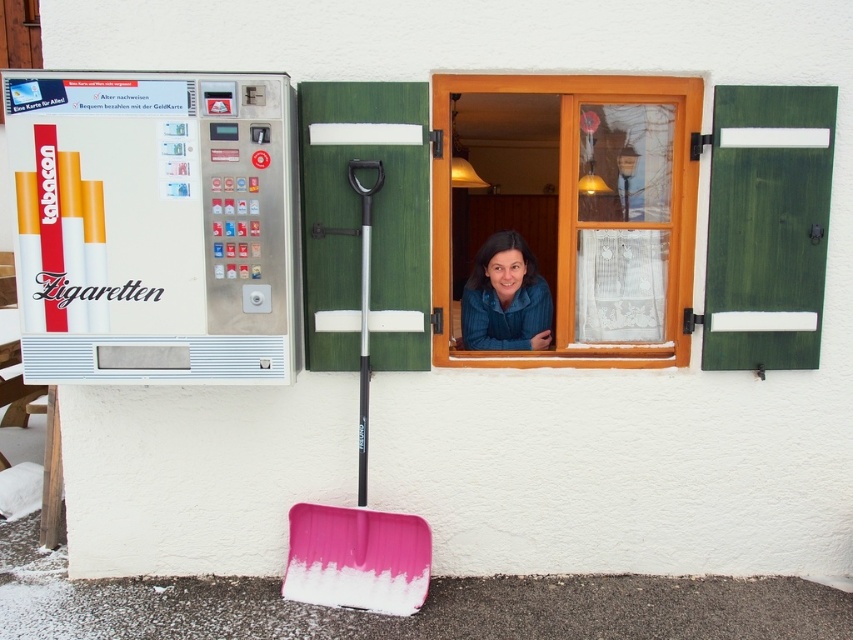
Is point (82, 355) less distant than point (465, 301)?

Yes, it is in front of point (465, 301).

Find the location of a particular element. metallic silver vending machine at left is located at coordinates (155, 225).

Is point (238, 262) farther from viewer compared to point (744, 150)?

No, (238, 262) is in front of (744, 150).

Locate an element on the screen. Image resolution: width=853 pixels, height=640 pixels. metallic silver vending machine at left is located at coordinates (155, 225).

In order to click on metallic silver vending machine at left in this screenshot , I will do `click(155, 225)`.

Describe the element at coordinates (573, 209) in the screenshot. I see `wooden window at center` at that location.

The width and height of the screenshot is (853, 640). Identify the location of wooden window at center. (573, 209).